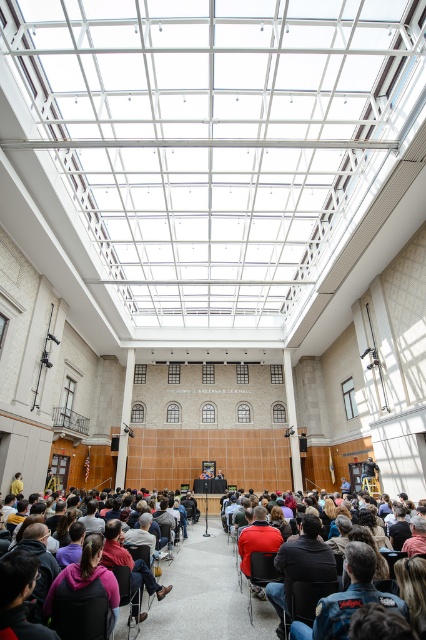
Who is more forward, (x=109, y=531) or (x=244, y=563)?

Point (x=109, y=531) is more forward.

Where is `dark gray fabric jacket at lower center`? The height and width of the screenshot is (640, 426). dark gray fabric jacket at lower center is located at coordinates (129, 561).

Is matte red shirt at center closer to the viewer compared to denim fabric chair at lower center?

No, matte red shirt at center is behind denim fabric chair at lower center.

Can you confirm if matte red shirt at center is bigger than denim fabric chair at lower center?

Indeed, matte red shirt at center has a larger size compared to denim fabric chair at lower center.

You are a GUI agent. You are given a task and a screenshot of the screen. Output one action in this format:
    pyautogui.click(x=<x>, y=<y>)
    Task: Click on the matte red shirt at center
    
    Given the screenshot: What is the action you would take?
    (258, 538)

Between dark gray hoodie at lower left and matte black chair at center, which one has more height?

dark gray hoodie at lower left

Can you confirm if dark gray hoodie at lower left is shorter than matte black chair at center?

No, dark gray hoodie at lower left is not shorter than matte black chair at center.

What do you see at coordinates (86, 573) in the screenshot? I see `dark gray hoodie at lower left` at bounding box center [86, 573].

The image size is (426, 640). In order to click on dark gray hoodie at lower left in this screenshot , I will do `click(86, 573)`.